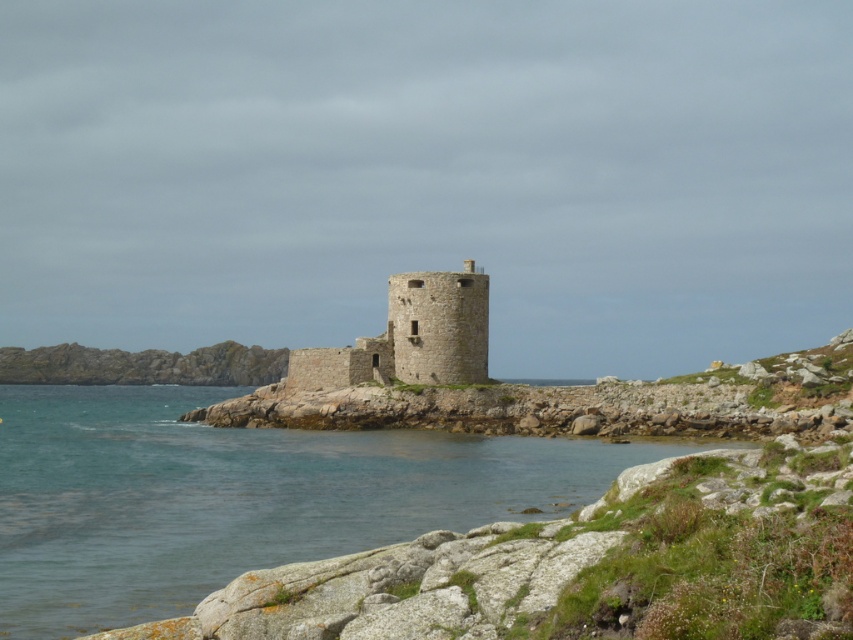
Question: Is clear water at lower left to the left of stone tower at center from the viewer's perspective?

Choices:
 (A) no
 (B) yes

Answer: (B)

Question: Is clear water at lower left positioned behind stone tower at center?

Choices:
 (A) yes
 (B) no

Answer: (B)

Question: Which object is farther from the camera taking this photo?

Choices:
 (A) clear water at lower left
 (B) stone tower at center

Answer: (B)

Question: Which object appears closest to the camera in this image?

Choices:
 (A) clear water at lower left
 (B) stone tower at center

Answer: (A)

Question: Is clear water at lower left wider than stone tower at center?

Choices:
 (A) yes
 (B) no

Answer: (A)